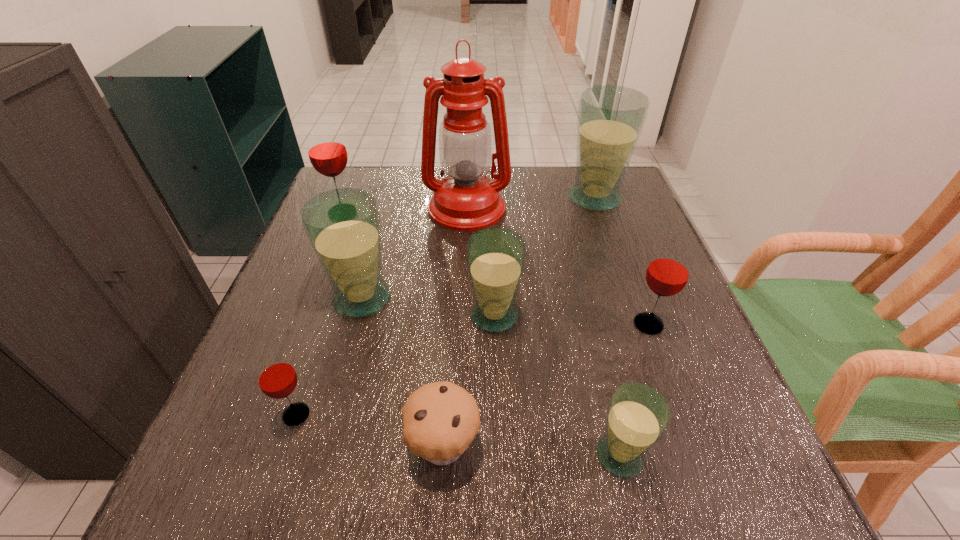
Identify the location of red glass that can be found as the third closest to the leftmost blue glass. The width and height of the screenshot is (960, 540). (668, 272).

Find the location of a particular element. vacant region that satisfies the following two spatial constraints: 1. on the back side of the smallest red glass; 2. on the left side of the tallest glass is located at coordinates (369, 198).

Identify the location of free space that satisfies the following two spatial constraints: 1. on the back side of the tallest object; 2. on the left side of the second biggest blue glass. (387, 208).